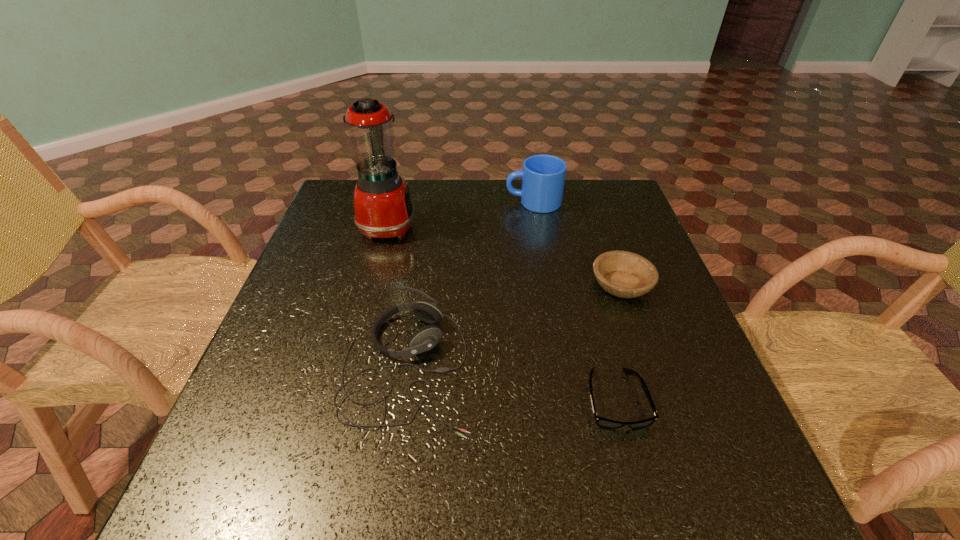
This screenshot has width=960, height=540. Identify the location of blank space that satisfies the following two spatial constraints: 1. on the side of the mug with the handle; 2. on the back side of the fourth tallest object. (547, 285).